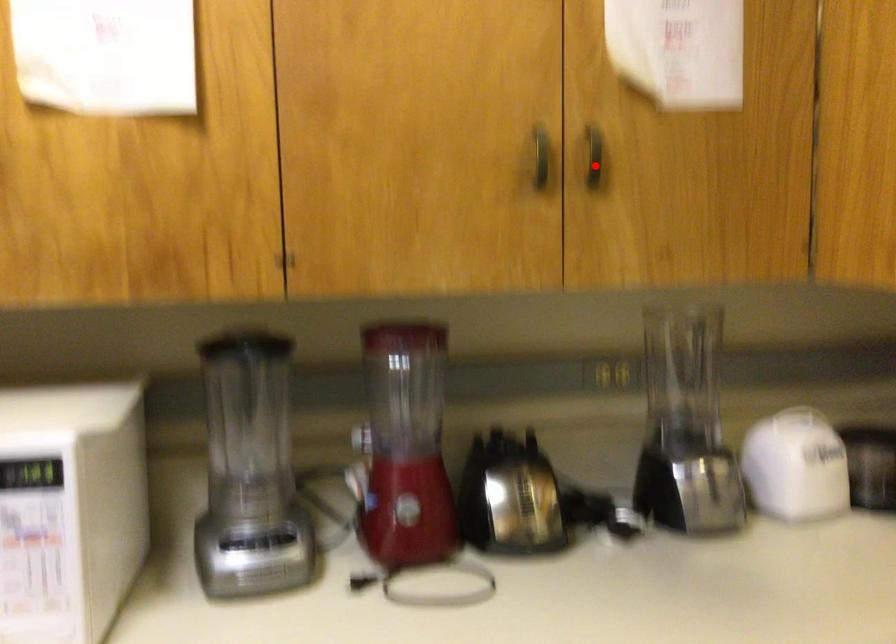
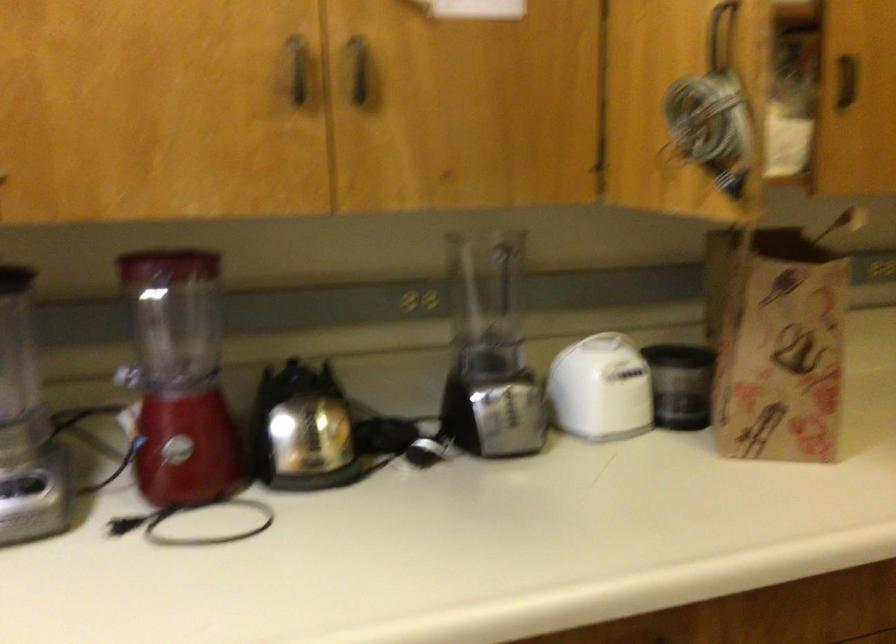
Question: I am providing you with two images of the same scene from different viewpoints. Given a red point in image1, look at the same physical point in image2. Is it:

Choices:
 (A) Closer to the viewpoint
 (B) Farther from the viewpoint

Answer: (A)